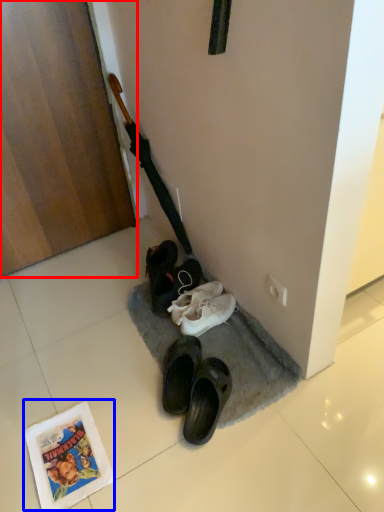
Question: Among these objects, which one is farthest to the camera, door (highlighted by a red box) or comic book (highlighted by a blue box)?

Choices:
 (A) door
 (B) comic book

Answer: (A)